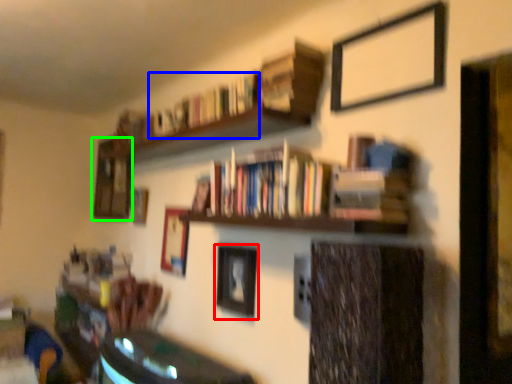
Question: Which is farther away from picture frame (highlighted by a red box)? book (highlighted by a blue box) or picture frame (highlighted by a green box)?

Choices:
 (A) book
 (B) picture frame

Answer: (B)